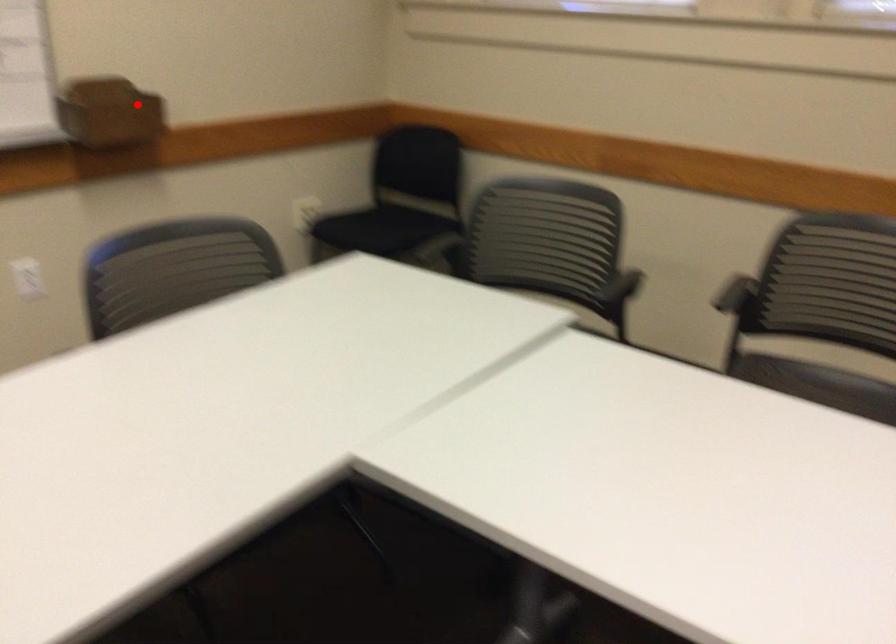
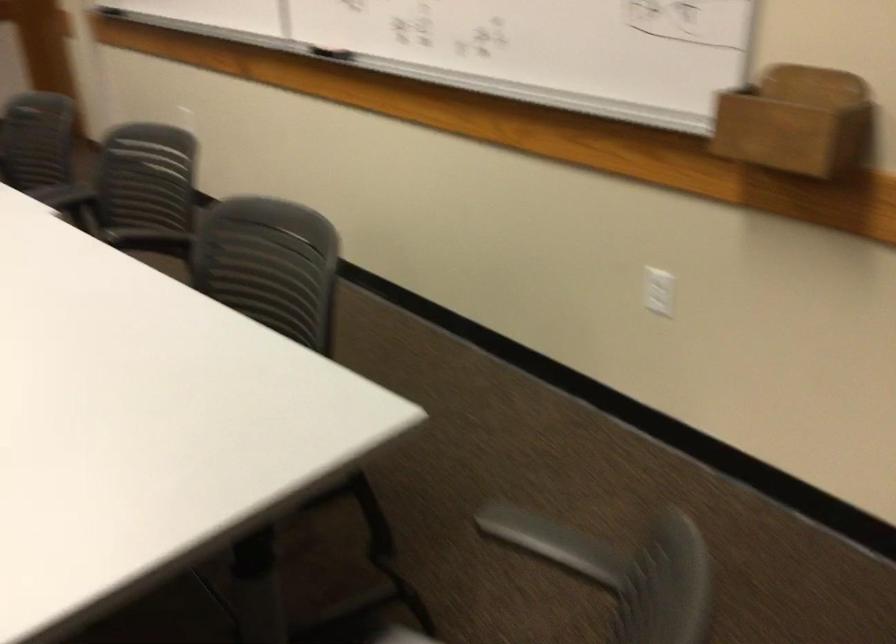
Question: I am providing you with two images of the same scene from different viewpoints. Image1 has a red point marked. In image2, the corresponding 3D location appears at what relative position? Reply with the corresponding letter.

Choices:
 (A) Closer
 (B) Farther

Answer: (A)